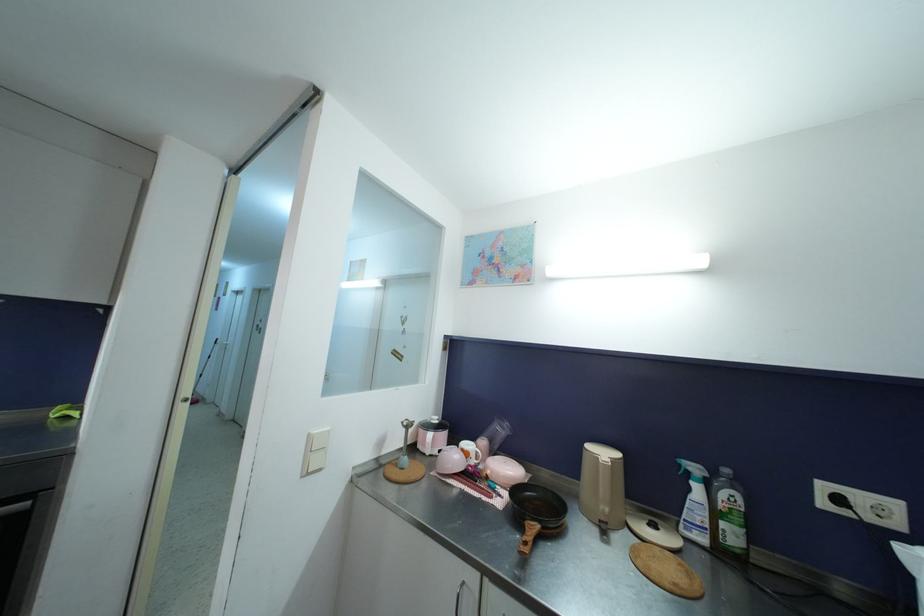
Find where to press the top white light switch. Please return your answer as a coordinate pair (x, y).

(321, 439)